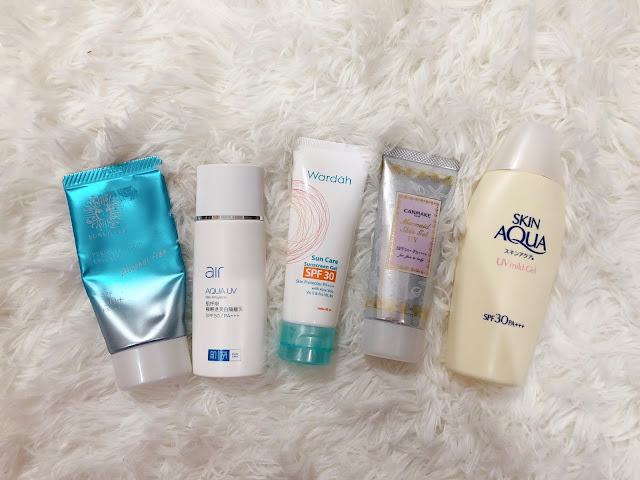
Provide coordinates for each where to hold toiletry bottles instance in the image. Your answer should be formatted as a list of tuples, i.e. [(x1, y1), (x2, y2), ...], where each tuple contains the x and y coordinates of a point satisfying the conditions above.

[(502, 291), (417, 289), (333, 227), (243, 278), (134, 276)]